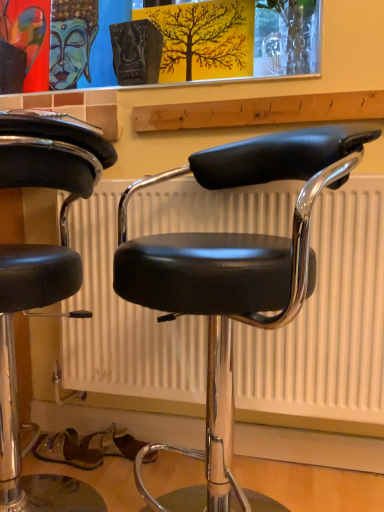
Question: Is black leather chair at center, which is the 2th chair from left to right, closer to the viewer compared to black leather stool at center, the 2th chair in the right-to-left sequence?

Choices:
 (A) yes
 (B) no

Answer: (A)

Question: Is black leather chair at center, which is the 2th chair from left to right, thinner than black leather stool at center, which ranks as the first chair in left-to-right order?

Choices:
 (A) yes
 (B) no

Answer: (B)

Question: From a real-world perspective, is black leather chair at center, the 1th chair positioned from the right, physically below black leather stool at center, which ranks as the first chair in left-to-right order?

Choices:
 (A) no
 (B) yes

Answer: (A)

Question: Does black leather chair at center, the 1th chair positioned from the right, have a greater height compared to black leather stool at center, the 2th chair in the right-to-left sequence?

Choices:
 (A) yes
 (B) no

Answer: (A)

Question: From the image's perspective, would you say black leather chair at center, which is the 2th chair from left to right, is positioned over black leather stool at center, which ranks as the first chair in left-to-right order?

Choices:
 (A) no
 (B) yes

Answer: (B)

Question: Considering the relative sizes of black leather chair at center, which is the 2th chair from left to right, and black leather stool at center, the 2th chair in the right-to-left sequence, in the image provided, is black leather chair at center, which is the 2th chair from left to right, shorter than black leather stool at center, the 2th chair in the right-to-left sequence,?

Choices:
 (A) yes
 (B) no

Answer: (B)

Question: Is the position of black leather stool at center, the 2th chair in the right-to-left sequence, less distant than that of black leather chair at center, the 1th chair positioned from the right?

Choices:
 (A) no
 (B) yes

Answer: (A)

Question: Can you confirm if black leather stool at center, the 2th chair in the right-to-left sequence, is bigger than black leather chair at center, which is the 2th chair from left to right?

Choices:
 (A) no
 (B) yes

Answer: (A)

Question: Is black leather stool at center, the 2th chair in the right-to-left sequence, further to camera compared to black leather chair at center, which is the 2th chair from left to right?

Choices:
 (A) no
 (B) yes

Answer: (B)

Question: Considering the relative sizes of black leather stool at center, which ranks as the first chair in left-to-right order, and black leather chair at center, which is the 2th chair from left to right, in the image provided, is black leather stool at center, which ranks as the first chair in left-to-right order, shorter than black leather chair at center, which is the 2th chair from left to right,?

Choices:
 (A) no
 (B) yes

Answer: (B)

Question: Is black leather stool at center, which ranks as the first chair in left-to-right order, at the right side of black leather chair at center, the 1th chair positioned from the right?

Choices:
 (A) yes
 (B) no

Answer: (B)

Question: Is black leather stool at center, which ranks as the first chair in left-to-right order, outside black leather chair at center, the 1th chair positioned from the right?

Choices:
 (A) no
 (B) yes

Answer: (B)

Question: Would you say black leather stool at center, which ranks as the first chair in left-to-right order, is inside or outside black leather chair at center, which is the 2th chair from left to right?

Choices:
 (A) outside
 (B) inside

Answer: (A)